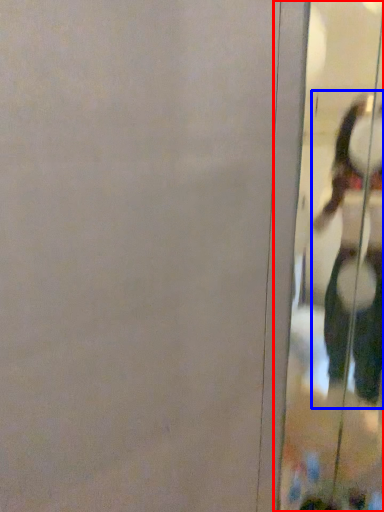
Question: Which object is closer to the camera taking this photo, screen door (highlighted by a red box) or person (highlighted by a blue box)?

Choices:
 (A) screen door
 (B) person

Answer: (A)